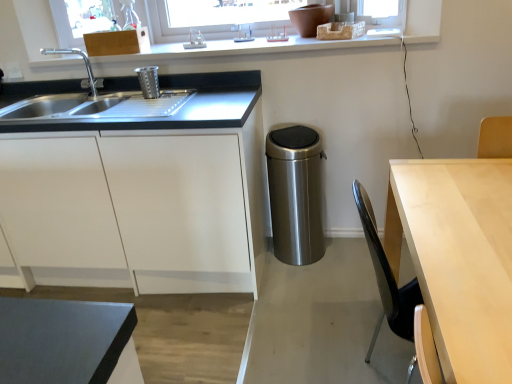
Locate an element on the screen. vacant space in front of brushed metal trash can at upper left, marked as the 1th appliance in a top-to-bottom arrangement is located at coordinates (139, 109).